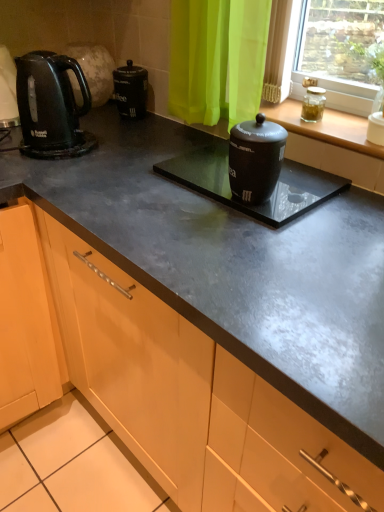
Question: Could clear glass jar at upper right be considered to be inside transparent glass jar at upper right?

Choices:
 (A) yes
 (B) no

Answer: (B)

Question: From the image's perspective, is transparent glass jar at upper right below clear glass jar at upper right?

Choices:
 (A) yes
 (B) no

Answer: (A)

Question: Is transparent glass jar at upper right outside clear glass jar at upper right?

Choices:
 (A) yes
 (B) no

Answer: (A)

Question: Does transparent glass jar at upper right have a lesser height compared to clear glass jar at upper right?

Choices:
 (A) no
 (B) yes

Answer: (B)

Question: Does transparent glass jar at upper right appear on the right side of clear glass jar at upper right?

Choices:
 (A) no
 (B) yes

Answer: (A)

Question: Considering the positions of point [182, 181] and point [72, 100], is point [182, 181] closer or farther from the camera than point [72, 100]?

Choices:
 (A) closer
 (B) farther

Answer: (A)

Question: Considering the positions of black matte canister at center, the 2th appliance from the top, and matte black kettle at left in the image, is black matte canister at center, the 2th appliance from the top, bigger or smaller than matte black kettle at left?

Choices:
 (A) small
 (B) big

Answer: (A)

Question: Do you think black matte canister at center, the 2th appliance from the top, is within matte black kettle at left, or outside of it?

Choices:
 (A) inside
 (B) outside

Answer: (B)

Question: Looking at their shapes, would you say black matte canister at center, which ranks as the 1th appliance in bottom-to-top order, is wider or thinner than matte black kettle at left?

Choices:
 (A) thin
 (B) wide

Answer: (B)

Question: Looking at the image, does black matte canister at center, which ranks as the 1th appliance in bottom-to-top order, seem bigger or smaller compared to clear glass jar at upper right?

Choices:
 (A) small
 (B) big

Answer: (A)

Question: Considering the positions of black matte canister at center, which ranks as the 1th appliance in bottom-to-top order, and clear glass jar at upper right in the image, is black matte canister at center, which ranks as the 1th appliance in bottom-to-top order, taller or shorter than clear glass jar at upper right?

Choices:
 (A) short
 (B) tall

Answer: (A)

Question: Do you think black matte canister at center, which ranks as the 1th appliance in bottom-to-top order, is within clear glass jar at upper right, or outside of it?

Choices:
 (A) inside
 (B) outside

Answer: (B)

Question: From the image's perspective, is black matte canister at center, which ranks as the 1th appliance in bottom-to-top order, located above or below clear glass jar at upper right?

Choices:
 (A) above
 (B) below

Answer: (B)

Question: In terms of height, does clear glass jar at upper right, the 2th appliance in the bottom-to-top sequence, look taller or shorter compared to black matte canister at center, which ranks as the 1th appliance in bottom-to-top order?

Choices:
 (A) short
 (B) tall

Answer: (B)

Question: Relative to black matte canister at center, the 2th appliance from the top, is clear glass jar at upper right, the 2th appliance in the bottom-to-top sequence, in front or behind?

Choices:
 (A) front
 (B) behind

Answer: (B)